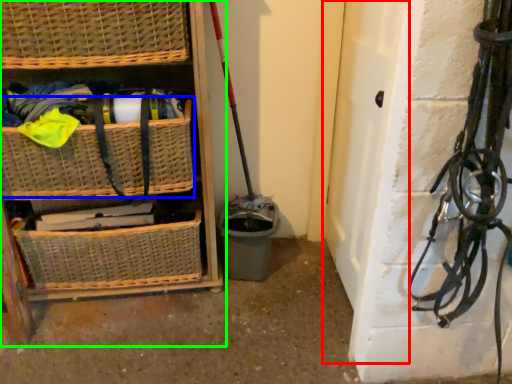
Question: Which is nearer to the door (highlighted by a red box)? basket (highlighted by a blue box) or shelf (highlighted by a green box).

Choices:
 (A) basket
 (B) shelf

Answer: (B)